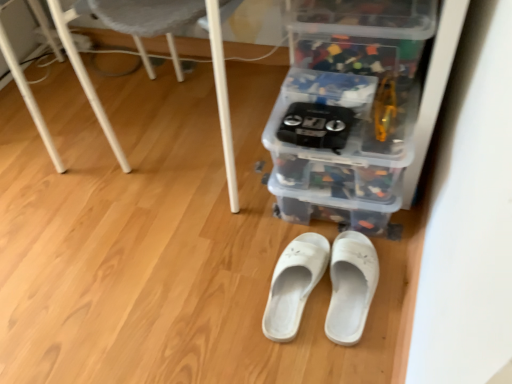
Find the location of a particular element. The image size is (512, 384). vacant space to the left of white plastic chair at lower center is located at coordinates point(78,179).